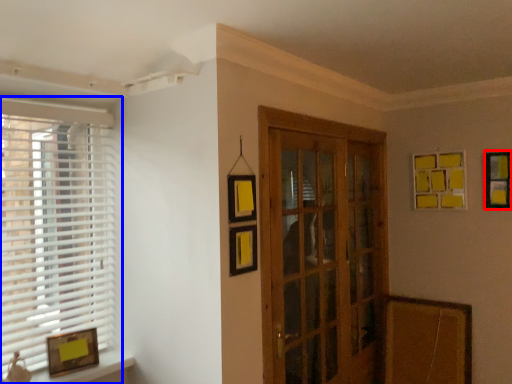
Question: Which of the following is the closest to the observer, picture frame (highlighted by a red box) or window (highlighted by a blue box)?

Choices:
 (A) picture frame
 (B) window

Answer: (B)